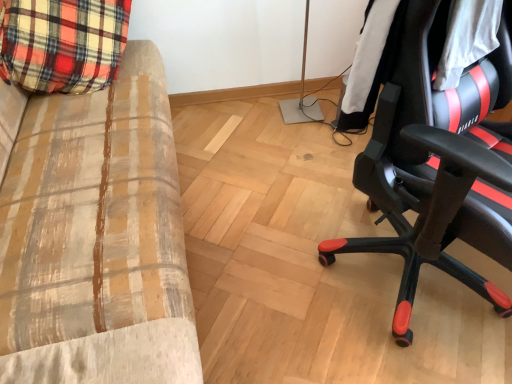
In order to face black leather jacket at right, should I rotate leftwards or rightwards?

You should rotate right by 24.450 degrees.

This screenshot has width=512, height=384. What do you see at coordinates (97, 239) in the screenshot?
I see `plaid fabric couch at left` at bounding box center [97, 239].

The width and height of the screenshot is (512, 384). Find the location of `plaid fabric couch at left`. plaid fabric couch at left is located at coordinates (97, 239).

You are a GUI agent. You are given a task and a screenshot of the screen. Output one action in this format:
    pyautogui.click(x=<x>, y=<y>)
    Task: Click on the black leather chair at right
    
    Given the screenshot: What is the action you would take?
    pyautogui.click(x=436, y=166)

Is plaid fabric couch at left looking in the opposite direction of black leather chair at right?

plaid fabric couch at left is not turned away from black leather chair at right.

Is plaid fabric couch at left not close to black leather chair at right?

That's not correct — plaid fabric couch at left is a little close to black leather chair at right.

From the image's perspective, would you say plaid fabric couch at left is positioned over black leather chair at right?

No, from the image's perspective, plaid fabric couch at left is not above black leather chair at right.

Consider the image. Is plaid fabric couch at left located outside black leather chair at right?

plaid fabric couch at left lies outside black leather chair at right's area.

The width and height of the screenshot is (512, 384). Identify the location of chair that appears on the right of black leather jacket at right. (436, 166).

From the image's perspective, which is below, black leather jacket at right or black leather chair at right?

From the image's view, black leather chair at right is below.

Does black leather jacket at right have a smaller size compared to black leather chair at right?

Correct, black leather jacket at right occupies less space than black leather chair at right.

Looking at their sizes, would you say black leather jacket at right is wider or thinner than black leather chair at right?

In the image, black leather jacket at right appears to be more narrow than black leather chair at right.

Is black leather chair at right not close to plaid fabric couch at left?

No, there isn't a large distance between black leather chair at right and plaid fabric couch at left.

Considering the sizes of black leather chair at right and plaid fabric couch at left in the image, is black leather chair at right taller or shorter than plaid fabric couch at left?

Clearly, black leather chair at right is taller compared to plaid fabric couch at left.

Who is bigger, black leather chair at right or plaid fabric couch at left?

plaid fabric couch at left is bigger.

At what (x,y) coordinates should I click in order to perform the action: click on furniture below the black leather chair at right (from the image's perspective). Please return your answer as a coordinate pair (x, y). The height and width of the screenshot is (384, 512). Looking at the image, I should click on (97, 239).

Can you see black leather chair at right touching black leather jacket at right?

No.

Considering the sizes of objects black leather chair at right and black leather jacket at right in the image provided, who is wider, black leather chair at right or black leather jacket at right?

With larger width is black leather chair at right.

In the scene shown: From the image's perspective, between black leather chair at right and black leather jacket at right, who is located below?

black leather chair at right appears lower in the image.

Is plaid fabric couch at left wider or thinner than black leather jacket at right?

Considering their sizes, plaid fabric couch at left looks broader than black leather jacket at right.

Can you tell me how much plaid fabric couch at left and black leather jacket at right differ in facing direction?

plaid fabric couch at left and black leather jacket at right are facing 64.1 degrees away from each other.

Can you confirm if plaid fabric couch at left is smaller than black leather jacket at right?

Actually, plaid fabric couch at left might be larger than black leather jacket at right.

Who is shorter, plaid fabric couch at left or black leather jacket at right?

With less height is black leather jacket at right.

Does black leather jacket at right have a greater height compared to plaid fabric couch at left?

No.

Between black leather jacket at right and plaid fabric couch at left, which one has larger width?

plaid fabric couch at left is wider.

Between point (383, 69) and point (105, 269), which one is positioned behind?

The point (105, 269) is farther from the camera.

How far apart are black leather jacket at right and plaid fabric couch at left?

black leather jacket at right and plaid fabric couch at left are 34.00 inches apart.

This screenshot has width=512, height=384. I want to click on furniture that is under the black leather chair at right (from a real-world perspective), so click(97, 239).

Where is `chair that is on the right side of black leather jacket at right`? Image resolution: width=512 pixels, height=384 pixels. chair that is on the right side of black leather jacket at right is located at coordinates (436, 166).

In the scene shown: From the image, which object appears to be farther from black leather jacket at right, black leather chair at right or plaid fabric couch at left?

Based on the image, plaid fabric couch at left appears to be further to black leather jacket at right.

Considering their positions, is black leather chair at right positioned closer to plaid fabric couch at left than black leather jacket at right?

The object closer to plaid fabric couch at left is black leather chair at right.

Considering their positions, is black leather jacket at right positioned closer to plaid fabric couch at left than black leather chair at right?

Result: The object closer to plaid fabric couch at left is black leather chair at right.

Considering their positions, is black leather jacket at right positioned closer to black leather chair at right than plaid fabric couch at left?

black leather jacket at right lies closer to black leather chair at right than the other object.

Estimate the real-world distances between objects in this image. Which object is further from black leather jacket at right, plaid fabric couch at left or black leather chair at right?

plaid fabric couch at left.

Looking at the image, which one is located closer to black leather chair at right, plaid fabric couch at left or black leather jacket at right?

black leather jacket at right lies closer to black leather chair at right than the other object.

You are a GUI agent. You are given a task and a screenshot of the screen. Output one action in this format:
    pyautogui.click(x=<x>, y=<y>)
    Task: Click on the clothing between plaid fabric couch at left and black leather chair at right in the horizontal direction
    
    Given the screenshot: What is the action you would take?
    pyautogui.click(x=379, y=71)